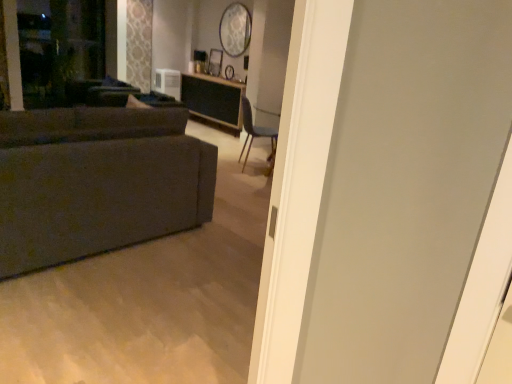
Question: Is point (x=33, y=84) positioned closer to the camera than point (x=19, y=193)?

Choices:
 (A) farther
 (B) closer

Answer: (A)

Question: Is transparent glass screen door at upper left taller or shorter than textured gray couch at left?

Choices:
 (A) tall
 (B) short

Answer: (A)

Question: Which object is positioned closest to the white plastic air conditioner at upper center?

Choices:
 (A) textured gray couch at left
 (B) blue fabric chair at center
 (C) transparent glass screen door at upper left
 (D) wooden table at center

Answer: (D)

Question: Which object is positioned closest to the transparent glass screen door at upper left?

Choices:
 (A) wooden table at center
 (B) blue fabric chair at center
 (C) white plastic air conditioner at upper center
 (D) textured gray couch at left

Answer: (C)